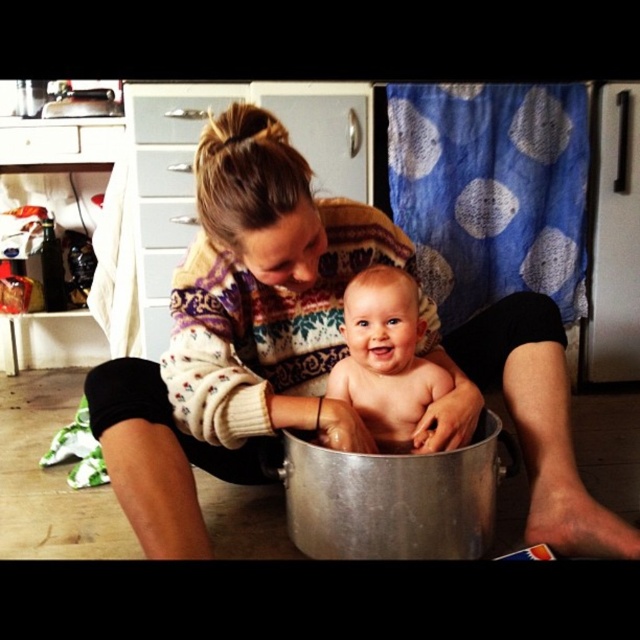
Question: Where is white knitted sweater at center located in relation to smooth skin baby at center in the image?

Choices:
 (A) right
 (B) left

Answer: (B)

Question: Among these points, which one is nearest to the camera?

Choices:
 (A) (316, 404)
 (B) (381, 337)

Answer: (A)

Question: Is white knitted sweater at center closer to the viewer compared to smooth skin baby at center?

Choices:
 (A) yes
 (B) no

Answer: (A)

Question: Is white knitted sweater at center bigger than smooth skin baby at center?

Choices:
 (A) yes
 (B) no

Answer: (A)